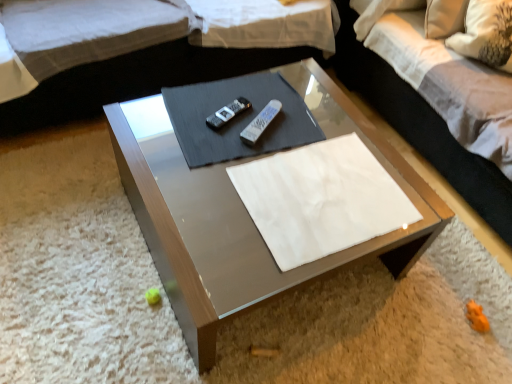
The image size is (512, 384). I want to click on free location above metallic glass coffee table at center (from a real-world perspective), so click(271, 152).